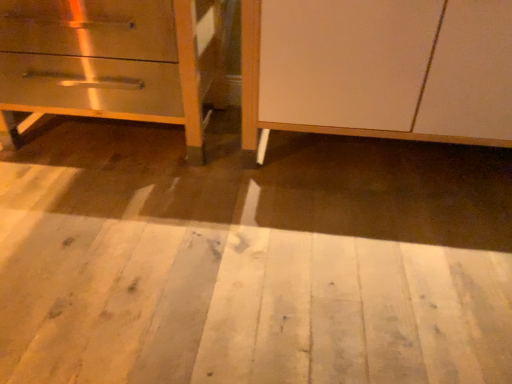
Question: Is the depth of white matte cabinet at center less than that of white wood floor at lower center?

Choices:
 (A) no
 (B) yes

Answer: (A)

Question: From a real-world perspective, is white matte cabinet at center on top of white wood floor at lower center?

Choices:
 (A) no
 (B) yes

Answer: (B)

Question: From the image's perspective, does white matte cabinet at center appear higher than white wood floor at lower center?

Choices:
 (A) yes
 (B) no

Answer: (A)

Question: Does white matte cabinet at center appear on the right side of white wood floor at lower center?

Choices:
 (A) yes
 (B) no

Answer: (A)

Question: Considering the relative sizes of white matte cabinet at center and white wood floor at lower center in the image provided, is white matte cabinet at center smaller than white wood floor at lower center?

Choices:
 (A) no
 (B) yes

Answer: (A)

Question: From the image's perspective, is white matte cabinet at center under white wood floor at lower center?

Choices:
 (A) yes
 (B) no

Answer: (B)

Question: Considering the relative sizes of white wood floor at lower center and white matte cabinet at center in the image provided, is white wood floor at lower center wider than white matte cabinet at center?

Choices:
 (A) no
 (B) yes

Answer: (B)

Question: From a real-world perspective, is white wood floor at lower center physically above white matte cabinet at center?

Choices:
 (A) yes
 (B) no

Answer: (B)

Question: Is white wood floor at lower center closer to the viewer compared to white matte cabinet at center?

Choices:
 (A) no
 (B) yes

Answer: (B)

Question: Is white wood floor at lower center surrounding white matte cabinet at center?

Choices:
 (A) no
 (B) yes

Answer: (A)

Question: Is white wood floor at lower center beside white matte cabinet at center?

Choices:
 (A) yes
 (B) no

Answer: (B)

Question: Is white wood floor at lower center taller than white matte cabinet at center?

Choices:
 (A) no
 (B) yes

Answer: (A)

Question: Is metallic silver drawer at left surrounding white matte cabinet at center?

Choices:
 (A) no
 (B) yes

Answer: (A)